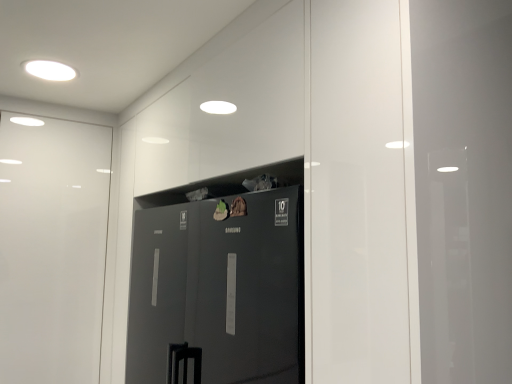
Locate an element on the screen. The image size is (512, 384). free point above white glossy light fixture at upper left (from a real-world perspective) is located at coordinates (56, 67).